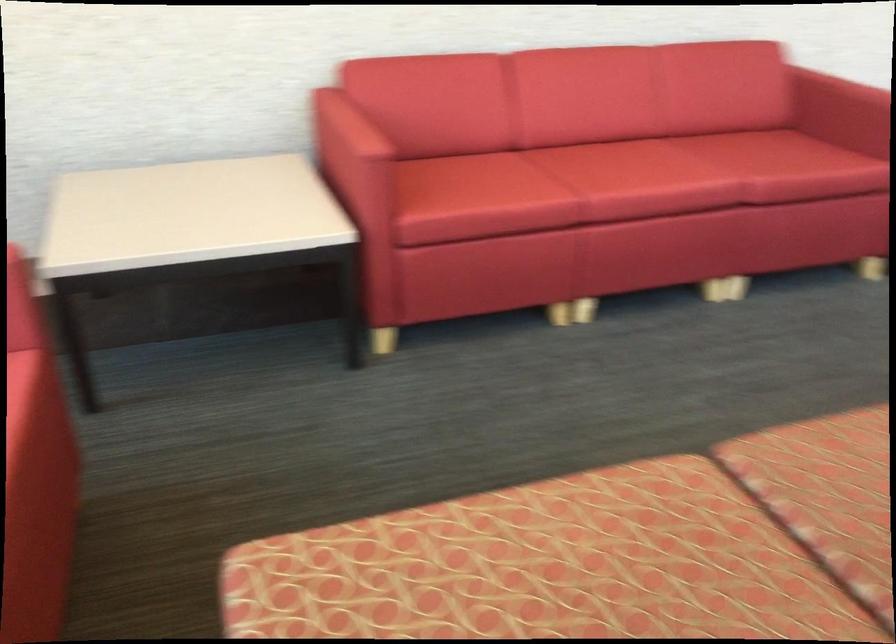
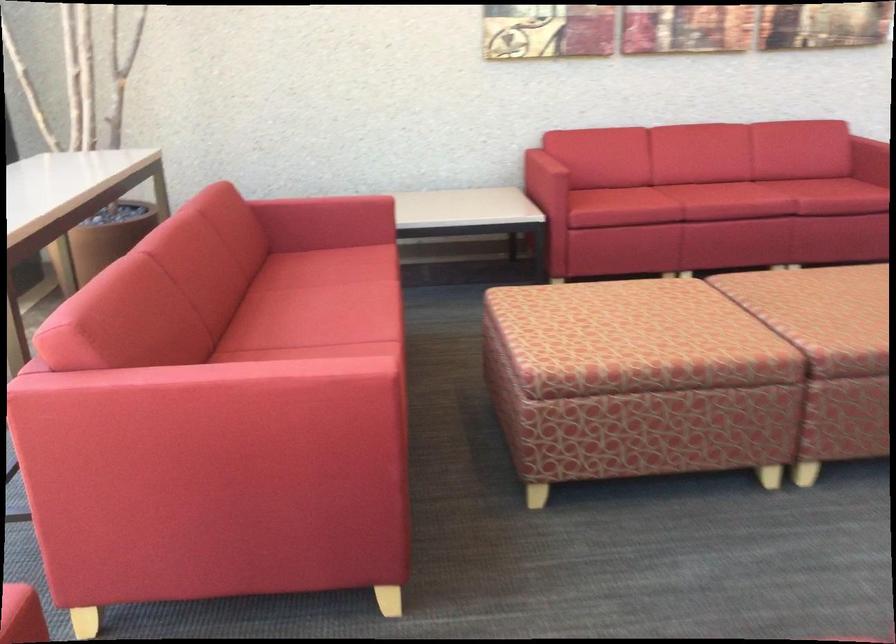
Question: What movement of the cameraman would produce the second image?

Choices:
 (A) Left
 (B) Right
 (C) Forward
 (D) Backward

Answer: (D)